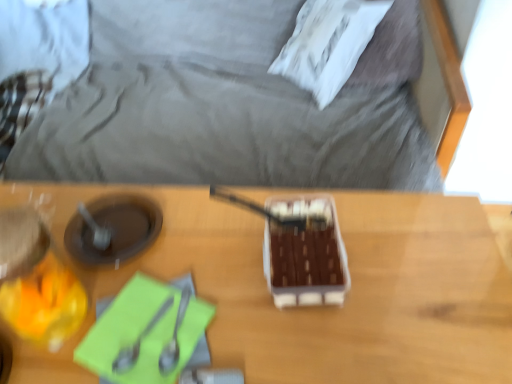
Locate an element on the screen. The height and width of the screenshot is (384, 512). free space behind satin silver spoon at center, the second utensil positioned from the left is located at coordinates (183, 251).